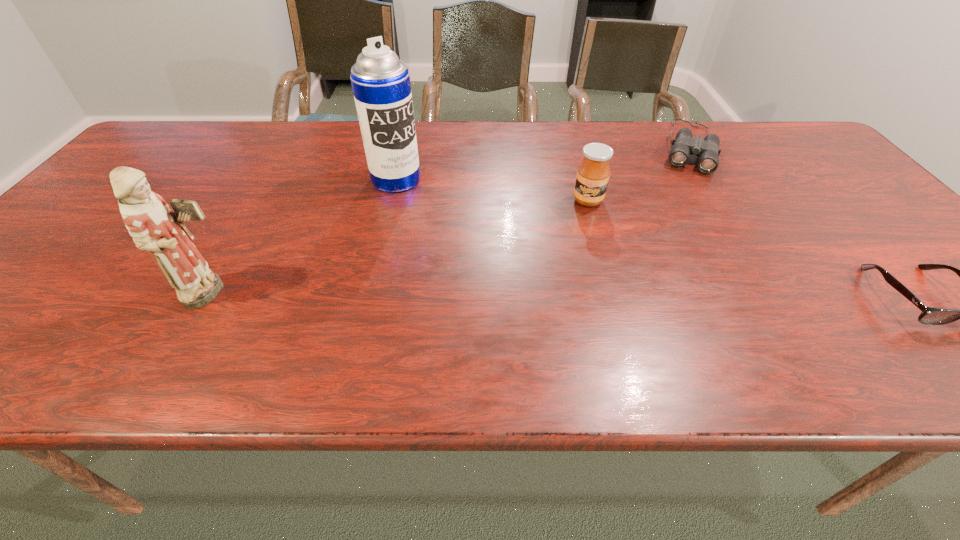
Find the location of `free space on the desktop that is between the figurine and the rightmost object and is positioned on the front-facing side of the third object from left to right`. free space on the desktop that is between the figurine and the rightmost object and is positioned on the front-facing side of the third object from left to right is located at coordinates (583, 295).

The image size is (960, 540). Find the location of `free space on the desktop that is between the leftmost object and the rightmost object and is positioned at the eyepiece of the fourth object from left to right`. free space on the desktop that is between the leftmost object and the rightmost object and is positioned at the eyepiece of the fourth object from left to right is located at coordinates (654, 296).

Where is `free space on the desktop that is between the figurine and the rightmost object and is positioned on the label side of the tallest object`? The height and width of the screenshot is (540, 960). free space on the desktop that is between the figurine and the rightmost object and is positioned on the label side of the tallest object is located at coordinates (508, 295).